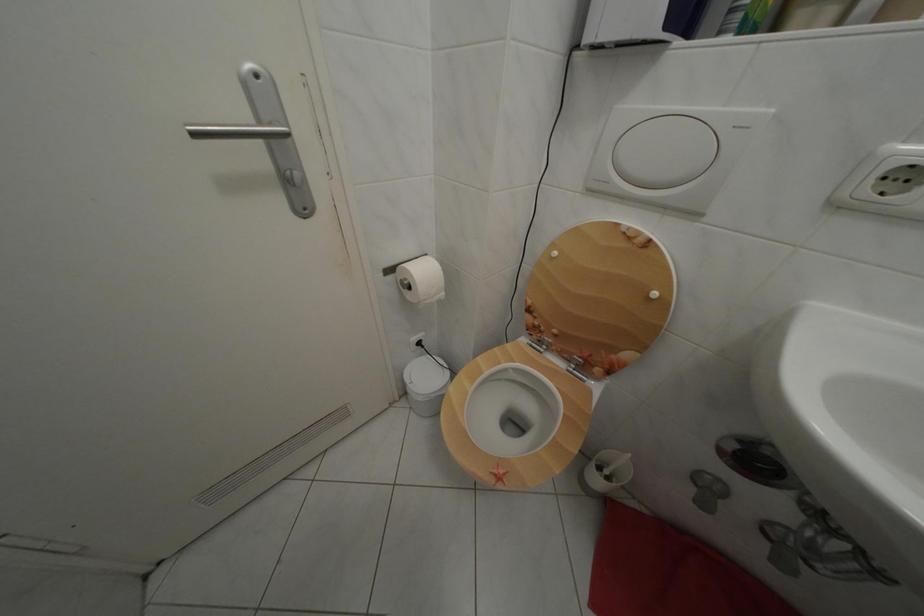
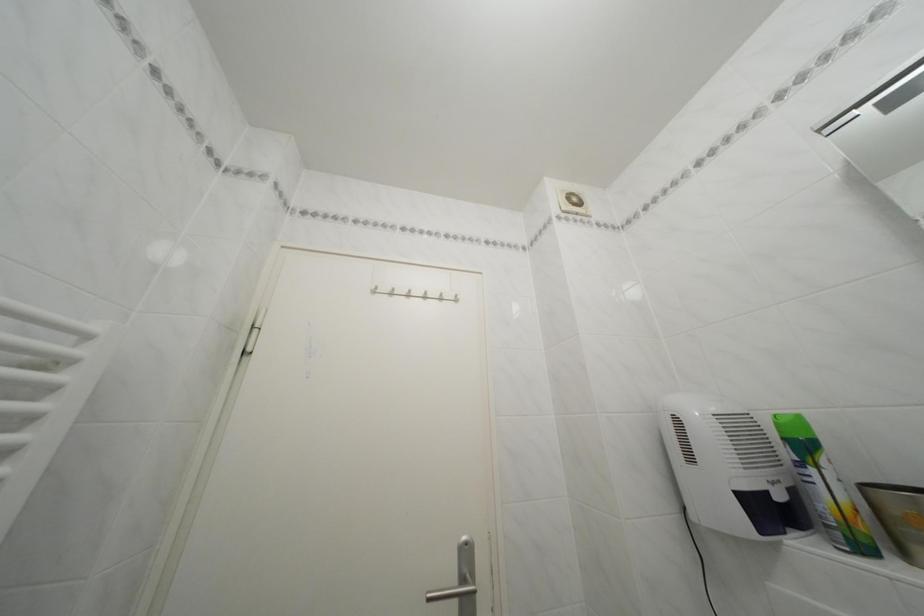
The point at (x=270, y=148) is marked in the first image. Where is the corresponding point in the second image?

(468, 608)